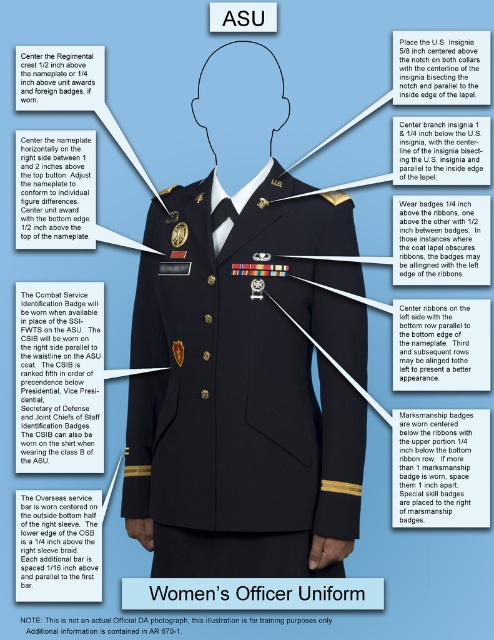
Question: Can you confirm if metallic gold cornett service identification badge at left is bigger than whitetextured fabricribbon at left side?

Choices:
 (A) yes
 (B) no

Answer: (A)

Question: Which of these objects is positioned farthest from the metallic gold marksmanship badge at center?

Choices:
 (A) overseas service bar at lower right
 (B) metallic gold cornett service identification badge at left
 (C) navy blue wool jacket at center

Answer: (B)

Question: Which point is farther to the camera?

Choices:
 (A) (42, 502)
 (B) (459, 131)

Answer: (B)

Question: Which object is the farthest from the black fabric women's officer uniform at center?

Choices:
 (A) white fabric nameplate at right side
 (B) metallic gold insignia at upper center

Answer: (A)

Question: Is white fabric nameplate at right side behind matte black nameplate at center?

Choices:
 (A) no
 (B) yes

Answer: (B)

Question: Is whitetextured fabricribbon at left side positioned at the back of center branch insignia at upper center?

Choices:
 (A) yes
 (B) no

Answer: (A)